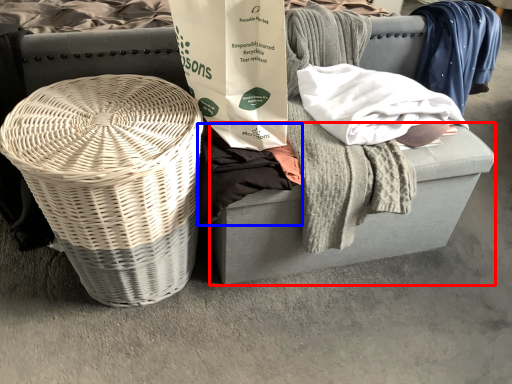
Question: Which point is closer to the camera, footrest (highlighted by a red box) or clothing (highlighted by a blue box)?

Choices:
 (A) footrest
 (B) clothing

Answer: (B)